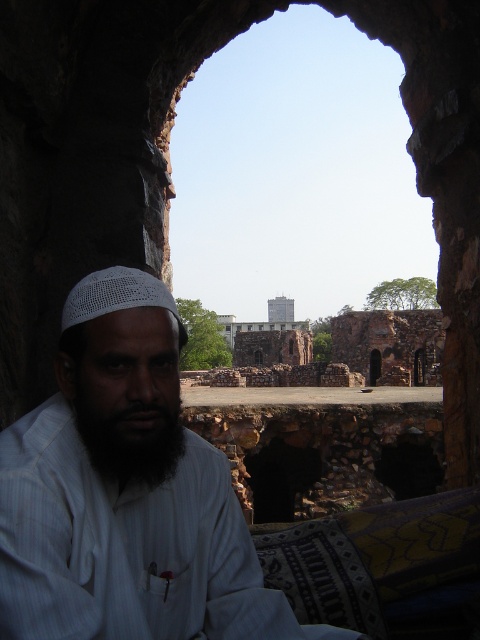
Between white clothed man at center and black matte beard at center, which one has more height?

With more height is white clothed man at center.

Measure the distance between point (95, 353) and camera.

A distance of 29.97 meters exists between point (95, 353) and camera.

Does point (71, 570) come closer to viewer compared to point (173, 426)?

Yes, it is in front of point (173, 426).

This screenshot has height=640, width=480. In order to click on white clothed man at center in this screenshot , I will do `click(126, 492)`.